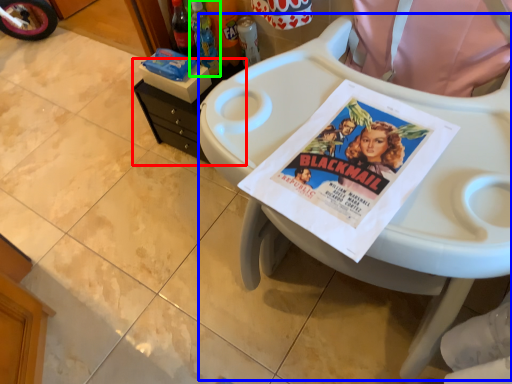
Question: Based on their relative distances, which object is farther from changing table (highlighted by a red box)? Choose from feeding chair (highlighted by a blue box) and bottle (highlighted by a green box).

Choices:
 (A) feeding chair
 (B) bottle

Answer: (A)